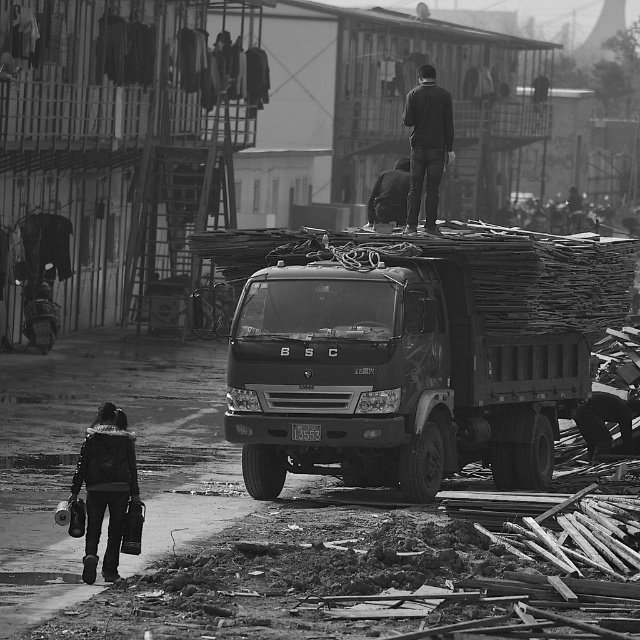
You are an architect reviewing a construction site photo. You need to locate the dark fabric jacket at upper center. What are its coordinates in the image?

The dark fabric jacket at upper center is located at coordinates point (426, 145).

Consider the image. Based on the scene description, what object is located at the coordinates point (x=390, y=378)?

The point (x=390, y=378) indicates the dark gray metallic truck at center.

You are a safety inspector at the construction site. You notice the dark gray metallic truck at center and the dark fabric jacket at upper center. According to safety regulations, all objects on the truck must not exceed the truck bed height. Is there a potential safety violation here?

The dark gray metallic truck at center has a lesser height compared to dark fabric jacket at upper center, which suggests that the jacket is positioned higher than the truck bed. This could indicate a safety violation as the jacket might be part of a load exceeding the truck bed height, violating the regulation.